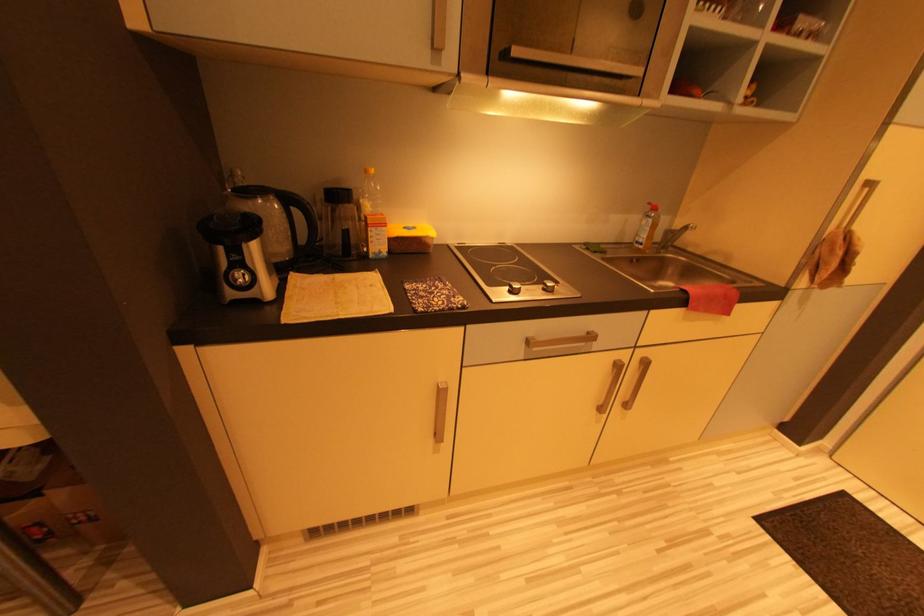
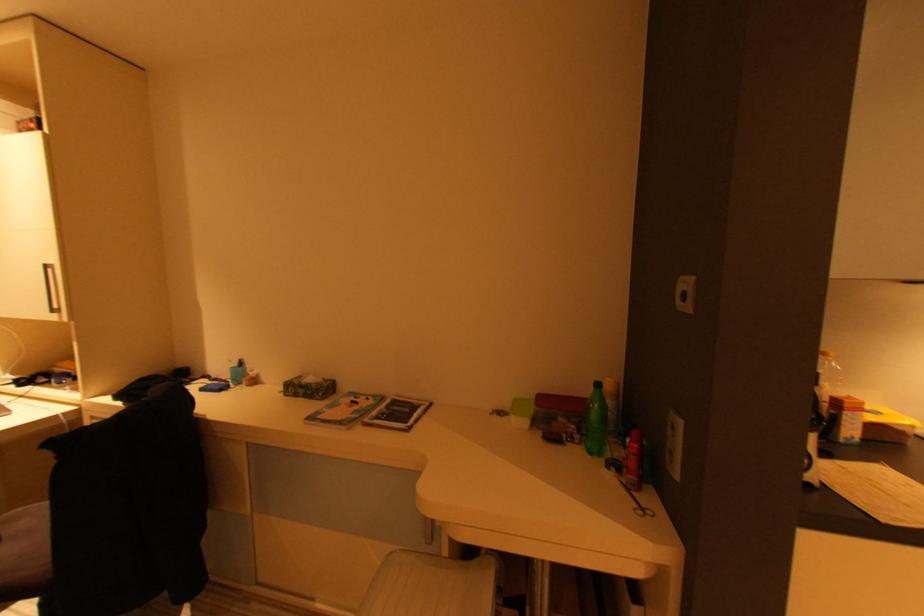
How did the camera likely rotate?

The camera's rotation is toward left-up.